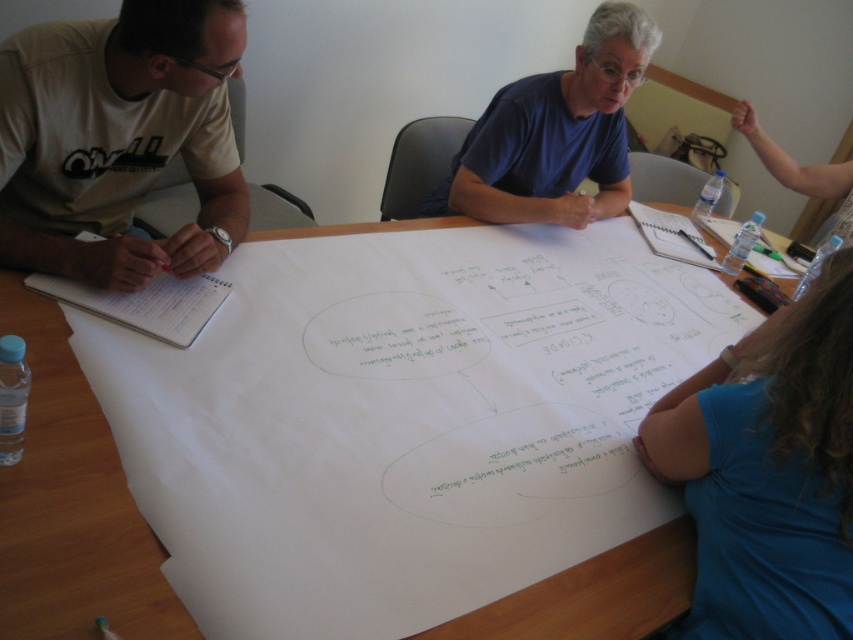
Is white paper at center positioned before white t-shirt at left?

Yes, it is.

Between point (3, 586) and point (62, 195), which one is positioned behind?

The point (62, 195) is more distant.

Is point (111, 573) positioned before point (206, 13)?

Yes.

Image resolution: width=853 pixels, height=640 pixels. I want to click on white paper at center, so click(x=73, y=506).

Can you confirm if white t-shirt at left is positioned above blue fabric shirt at lower right?

Yes, white t-shirt at left is above blue fabric shirt at lower right.

Between point (192, 144) and point (721, 556), which one is positioned behind?

The point (192, 144) is behind.

I want to click on white t-shirt at left, so click(x=119, y=138).

Can you confirm if white paper at center is bigger than blue cotton shirt at upper center?

Actually, white paper at center might be smaller than blue cotton shirt at upper center.

Is white paper at center further to the viewer compared to blue cotton shirt at upper center?

No, white paper at center is closer to the viewer.

Image resolution: width=853 pixels, height=640 pixels. What do you see at coordinates (73, 506) in the screenshot?
I see `white paper at center` at bounding box center [73, 506].

Locate an element on the screen. This screenshot has height=640, width=853. white paper at center is located at coordinates (73, 506).